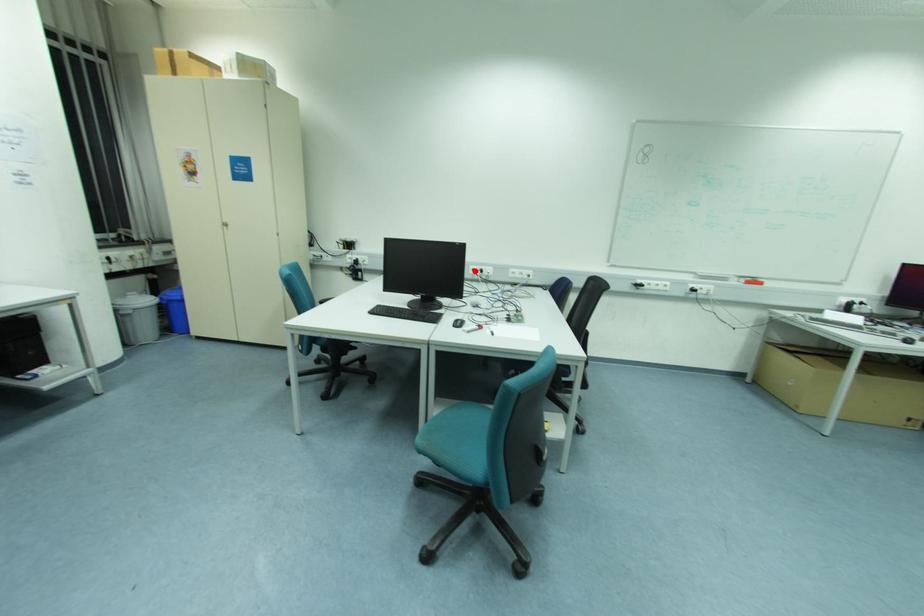
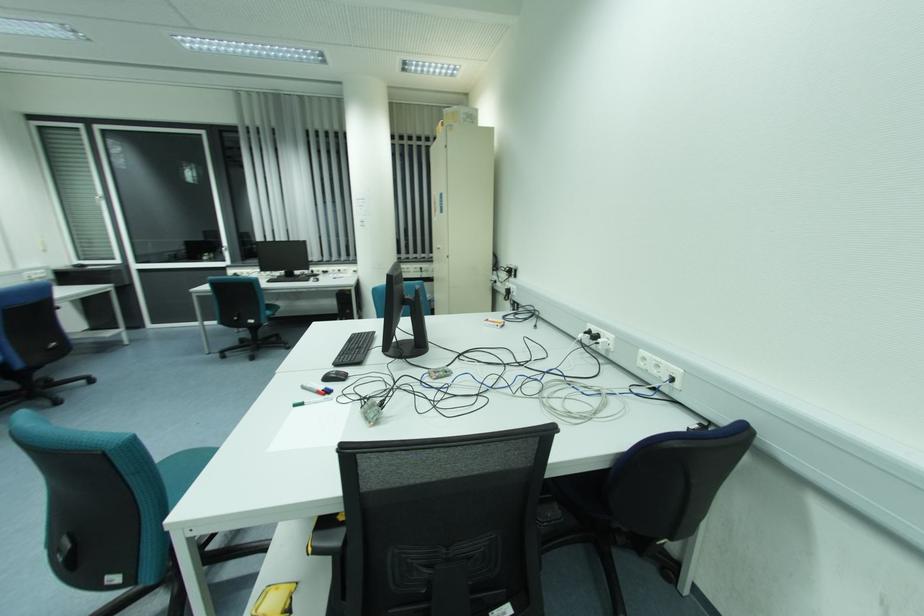
Find the pixel in the second image that matches the highlighted location in the first image.

(590, 333)